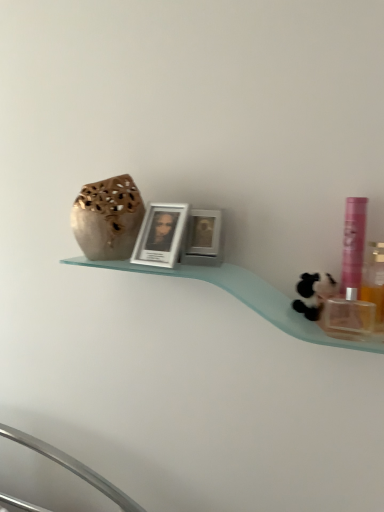
Question: Is pink plastic mouthwash at right, which is counted as the second mouthwash, starting from the right, bigger than translucent plastic bottle at right, marked as the first mouthwash in a right-to-left arrangement?

Choices:
 (A) no
 (B) yes

Answer: (A)

Question: Is translucent plastic bottle at right, marked as the first mouthwash in a right-to-left arrangement, at the back of pink plastic mouthwash at right, arranged as the first mouthwash when viewed from the left?

Choices:
 (A) yes
 (B) no

Answer: (B)

Question: Can you confirm if pink plastic mouthwash at right, which is counted as the second mouthwash, starting from the right, is wider than translucent plastic bottle at right, marked as the first mouthwash in a right-to-left arrangement?

Choices:
 (A) no
 (B) yes

Answer: (A)

Question: From the image's perspective, is pink plastic mouthwash at right, arranged as the first mouthwash when viewed from the left, on top of translucent plastic bottle at right, which appears as the second mouthwash when viewed from the left?

Choices:
 (A) yes
 (B) no

Answer: (A)

Question: Is pink plastic mouthwash at right, arranged as the first mouthwash when viewed from the left, not within translucent plastic bottle at right, marked as the first mouthwash in a right-to-left arrangement?

Choices:
 (A) no
 (B) yes

Answer: (B)

Question: Could you tell me if pink plastic mouthwash at right, arranged as the first mouthwash when viewed from the left, is facing translucent plastic bottle at right, marked as the first mouthwash in a right-to-left arrangement?

Choices:
 (A) no
 (B) yes

Answer: (A)

Question: Can you confirm if translucent plastic bottle at right, marked as the first mouthwash in a right-to-left arrangement, is positioned to the left of matte beige vase at upper left?

Choices:
 (A) no
 (B) yes

Answer: (A)

Question: Can you confirm if translucent plastic bottle at right, which appears as the second mouthwash when viewed from the left, is wider than matte beige vase at upper left?

Choices:
 (A) no
 (B) yes

Answer: (A)

Question: Is translucent plastic bottle at right, which appears as the second mouthwash when viewed from the left, oriented away from matte beige vase at upper left?

Choices:
 (A) no
 (B) yes

Answer: (A)

Question: From the image's perspective, does translucent plastic bottle at right, marked as the first mouthwash in a right-to-left arrangement, appear lower than matte beige vase at upper left?

Choices:
 (A) yes
 (B) no

Answer: (A)

Question: Are translucent plastic bottle at right, which appears as the second mouthwash when viewed from the left, and matte beige vase at upper left far apart?

Choices:
 (A) yes
 (B) no

Answer: (B)

Question: Is translucent plastic bottle at right, which appears as the second mouthwash when viewed from the left, positioned beyond the bounds of matte beige vase at upper left?

Choices:
 (A) yes
 (B) no

Answer: (A)

Question: Does metallic silver picture frame at center, the 2th picture frame when ordered from left to right, come in front of pink plastic mouthwash at right, arranged as the first mouthwash when viewed from the left?

Choices:
 (A) no
 (B) yes

Answer: (A)